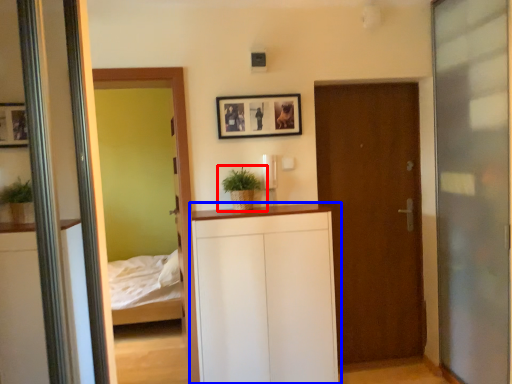
Question: Which point is further to the camera, houseplant (highlighted by a red box) or dresser (highlighted by a blue box)?

Choices:
 (A) houseplant
 (B) dresser

Answer: (A)